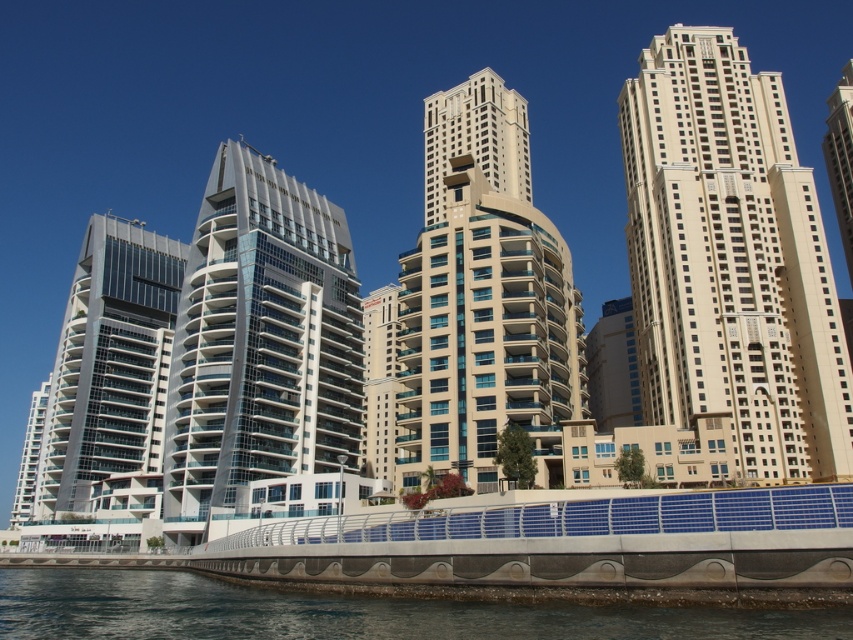
You are a city planner analyzing the urban layout of this waterfront area. Given the coordinates provided for the beige glass building at center, how would you describe its central location relative to the waterfront promenade and the surrounding high rises?

The beige glass building at center is positioned at coordinates point (474, 307), which places it centrally within the waterfront area, balancing its placement between the promenade and the surrounding high rises.

You are an urban planner evaluating the skyline of this city. You notice the beige glass building at center and the beige glass tower at upper right. Which structure would cast a shorter shadow during midday when the sun is directly overhead?

The beige glass building at center has a lesser height compared to the beige glass tower at upper right, so it would cast a shorter shadow during midday when the sun is directly overhead.